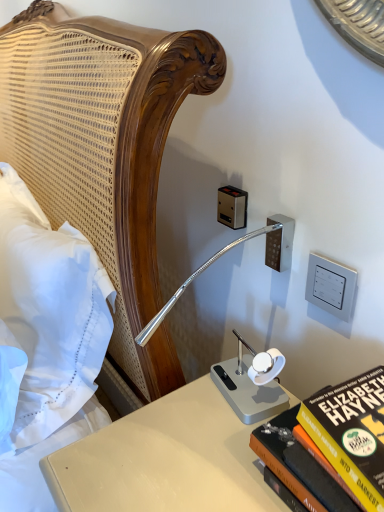
What do you see at coordinates (332, 445) in the screenshot? I see `hardcover book at lower right` at bounding box center [332, 445].

Describe the element at coordinates (232, 207) in the screenshot. I see `metallic silver outlet at upper center, the 2th electric outlet when ordered from right to left` at that location.

The width and height of the screenshot is (384, 512). What are the coordinates of `hardcover book at lower right` in the screenshot? It's located at (332, 445).

Is white plastic switch at upper right, the first electric outlet positioned from the front, to the left or to the right of hardcover book at lower right in the image?

In the image, white plastic switch at upper right, the first electric outlet positioned from the front, appears on the right side of hardcover book at lower right.

Image resolution: width=384 pixels, height=512 pixels. I want to click on book below the white plastic switch at upper right, which ranks as the first electric outlet in bottom-to-top order (from a real-world perspective), so click(332, 445).

Is point (316, 287) positioned after point (272, 431)?

Yes.

Is white plastic switch at upper right, which ranks as the first electric outlet in bottom-to-top order, in contact with hardcover book at lower right?

No, white plastic switch at upper right, which ranks as the first electric outlet in bottom-to-top order, is not with hardcover book at lower right.

Is hardcover book at lower right touching white plastic switch at upper right, which ranks as the 2th electric outlet in back-to-front order?

No, hardcover book at lower right is not making contact with white plastic switch at upper right, which ranks as the 2th electric outlet in back-to-front order.

From the image's perspective, between hardcover book at lower right and white plastic switch at upper right, which ranks as the 2th electric outlet in back-to-front order, which one is located above?

white plastic switch at upper right, which ranks as the 2th electric outlet in back-to-front order, is shown above in the image.

Relative to white plastic switch at upper right, acting as the second electric outlet starting from the top, is hardcover book at lower right in front or behind?

hardcover book at lower right is in front of white plastic switch at upper right, acting as the second electric outlet starting from the top.

The width and height of the screenshot is (384, 512). There is a hardcover book at lower right. What are the coordinates of `the 1st electric outlet above it (from the image's perspective)` in the screenshot? It's located at (330, 286).

Would you say white cotton pillow at left is inside or outside white plastic switch at upper right, the 1th electric outlet positioned from the right?

white cotton pillow at left is outside white plastic switch at upper right, the 1th electric outlet positioned from the right.

Considering the sizes of objects white cotton pillow at left and white plastic switch at upper right, the 1th electric outlet positioned from the right, in the image provided, who is taller, white cotton pillow at left or white plastic switch at upper right, the 1th electric outlet positioned from the right,?

white cotton pillow at left.

Is white cotton pillow at left oriented away from white plastic switch at upper right, the first electric outlet positioned from the front?

No, white cotton pillow at left's orientation is not away from white plastic switch at upper right, the first electric outlet positioned from the front.

In the image, there is a white plastic switch at upper right, the first electric outlet positioned from the front. Where is `pillow below it (from a real-world perspective)`? The height and width of the screenshot is (512, 384). pillow below it (from a real-world perspective) is located at coordinates (50, 311).

Which object is further away from the camera taking this photo, metallic silver outlet at upper center, acting as the first electric outlet starting from the left, or hardcover book at lower right?

metallic silver outlet at upper center, acting as the first electric outlet starting from the left, is more distant.

Locate an element on the screen. book below the metallic silver outlet at upper center, acting as the first electric outlet starting from the back (from the image's perspective) is located at coordinates (332, 445).

Is metallic silver outlet at upper center, which ranks as the second electric outlet in bottom-to-top order, aimed at hardcover book at lower right?

No, metallic silver outlet at upper center, which ranks as the second electric outlet in bottom-to-top order, is not facing towards hardcover book at lower right.

Between metallic silver outlet at upper center, the 2th electric outlet when ordered from right to left, and hardcover book at lower right, which one has smaller width?

Thinner between the two is metallic silver outlet at upper center, the 2th electric outlet when ordered from right to left.

Considering the sizes of objects metallic silver outlet at upper center, the 2th electric outlet when ordered from right to left, and white cotton pillow at left in the image provided, who is wider, metallic silver outlet at upper center, the 2th electric outlet when ordered from right to left, or white cotton pillow at left?

white cotton pillow at left.

From a real-world perspective, which object stands above the other?

From a 3D spatial view, metallic silver outlet at upper center, which ranks as the second electric outlet in bottom-to-top order, is above.

Is metallic silver outlet at upper center, arranged as the first electric outlet when viewed from the top, positioned behind white cotton pillow at left?

That is True.

Is the surface of metallic silver outlet at upper center, acting as the first electric outlet starting from the left, in direct contact with white cotton pillow at left?

metallic silver outlet at upper center, acting as the first electric outlet starting from the left, and white cotton pillow at left are clearly separated.

Is hardcover book at lower right bigger than metallic silver outlet at upper center, the 2th electric outlet when ordered from right to left?

Yes, hardcover book at lower right is bigger than metallic silver outlet at upper center, the 2th electric outlet when ordered from right to left.

Can you confirm if hardcover book at lower right is positioned to the left of metallic silver outlet at upper center, acting as the first electric outlet starting from the left?

In fact, hardcover book at lower right is to the right of metallic silver outlet at upper center, acting as the first electric outlet starting from the left.

Does hardcover book at lower right have a lesser width compared to metallic silver outlet at upper center, which ranks as the second electric outlet in bottom-to-top order?

In fact, hardcover book at lower right might be wider than metallic silver outlet at upper center, which ranks as the second electric outlet in bottom-to-top order.

This screenshot has width=384, height=512. I want to click on electric outlet on the left of hardcover book at lower right, so click(x=232, y=207).

Find the location of a particular element. Image resolution: width=384 pixels, height=512 pixels. electric outlet in front of the metallic silver outlet at upper center, acting as the first electric outlet starting from the left is located at coordinates (330, 286).

Is white plastic switch at upper right, which ranks as the 2th electric outlet in back-to-front order, completely or partially inside metallic silver outlet at upper center, the 2th electric outlet when ordered from right to left?

Actually, white plastic switch at upper right, which ranks as the 2th electric outlet in back-to-front order, is outside metallic silver outlet at upper center, the 2th electric outlet when ordered from right to left.

Is metallic silver outlet at upper center, arranged as the first electric outlet when viewed from the top, far away from white plastic switch at upper right, which ranks as the 2th electric outlet in back-to-front order?

No, metallic silver outlet at upper center, arranged as the first electric outlet when viewed from the top, is in close proximity to white plastic switch at upper right, which ranks as the 2th electric outlet in back-to-front order.

Could you measure the distance between metallic silver outlet at upper center, acting as the first electric outlet starting from the back, and white plastic switch at upper right, positioned as the second electric outlet in left-to-right order?

metallic silver outlet at upper center, acting as the first electric outlet starting from the back, is 8.81 inches away from white plastic switch at upper right, positioned as the second electric outlet in left-to-right order.

Starting from the hardcover book at lower right, which electric outlet is the 1st one behind? Please provide its 2D coordinates.

[(330, 286)]

Locate an element on the screen. Image resolution: width=384 pixels, height=512 pixels. book in front of the white plastic switch at upper right, the first electric outlet positioned from the front is located at coordinates (332, 445).

Considering their positions, is metallic silver outlet at upper center, which ranks as the second electric outlet in bottom-to-top order, positioned closer to white cotton pillow at left than white plastic switch at upper right, positioned as the second electric outlet in left-to-right order?

Among the two, metallic silver outlet at upper center, which ranks as the second electric outlet in bottom-to-top order, is located nearer to white cotton pillow at left.

From the image, which object appears to be farther from white cotton pillow at left, white plastic switch at upper right, acting as the second electric outlet starting from the top, or hardcover book at lower right?

Based on the image, white plastic switch at upper right, acting as the second electric outlet starting from the top, appears to be further to white cotton pillow at left.

From the image, which object appears to be farther from white plastic switch at upper right, the 1th electric outlet positioned from the right, hardcover book at lower right or metallic silver outlet at upper center, acting as the first electric outlet starting from the back?

metallic silver outlet at upper center, acting as the first electric outlet starting from the back, is positioned further to the anchor white plastic switch at upper right, the 1th electric outlet positioned from the right.

Considering their positions, is white cotton pillow at left positioned closer to white plastic switch at upper right, which ranks as the 2th electric outlet in back-to-front order, than hardcover book at lower right?

Among the two, hardcover book at lower right is located nearer to white plastic switch at upper right, which ranks as the 2th electric outlet in back-to-front order.

From the image, which object appears to be nearer to hardcover book at lower right, white plastic switch at upper right, the first electric outlet positioned from the front, or white cotton pillow at left?

white plastic switch at upper right, the first electric outlet positioned from the front.

Based on their spatial positions, is metallic silver outlet at upper center, arranged as the second electric outlet when viewed from the front, or white plastic switch at upper right, the first electric outlet positioned from the front, further from hardcover book at lower right?

metallic silver outlet at upper center, arranged as the second electric outlet when viewed from the front, is further to hardcover book at lower right.

Considering their positions, is white plastic switch at upper right, which ranks as the 2th electric outlet in back-to-front order, positioned closer to white cotton pillow at left than metallic silver outlet at upper center, acting as the first electric outlet starting from the left?

The object closer to white cotton pillow at left is metallic silver outlet at upper center, acting as the first electric outlet starting from the left.

When comparing their distances from hardcover book at lower right, does white cotton pillow at left or metallic silver outlet at upper center, which ranks as the second electric outlet in bottom-to-top order, seem closer?

metallic silver outlet at upper center, which ranks as the second electric outlet in bottom-to-top order, is closer to hardcover book at lower right.

I want to click on book located between white cotton pillow at left and white plastic switch at upper right, acting as the second electric outlet starting from the top, in the left-right direction, so click(332, 445).

Image resolution: width=384 pixels, height=512 pixels. I want to click on electric outlet between white cotton pillow at left and hardcover book at lower right, so click(232, 207).

Identify the location of electric outlet situated between white cotton pillow at left and white plastic switch at upper right, which ranks as the first electric outlet in bottom-to-top order, from left to right. The width and height of the screenshot is (384, 512). (232, 207).

Locate an element on the screen. electric outlet positioned between hardcover book at lower right and metallic silver outlet at upper center, the 2th electric outlet when ordered from right to left, from near to far is located at coordinates (330, 286).